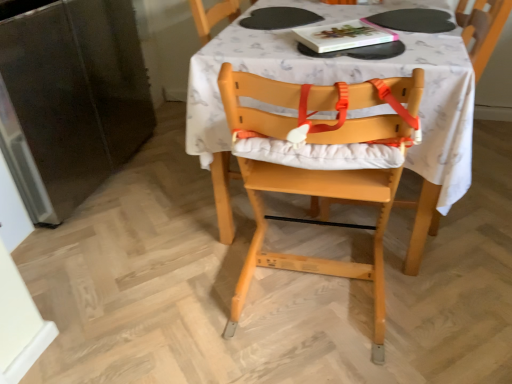
At what (x,y) coordinates should I click in order to perform the action: click on free space to the left of hardcover book at upper center. Please return your answer as a coordinate pair (x, y). The height and width of the screenshot is (384, 512). Looking at the image, I should click on [267, 37].